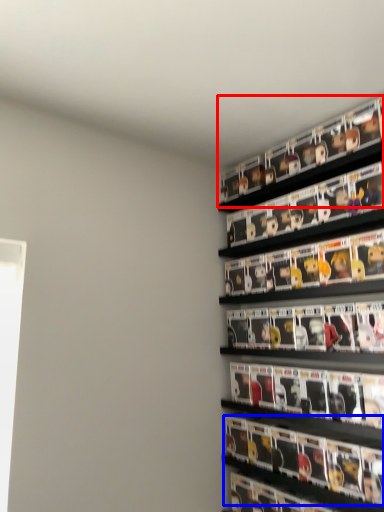
Question: Which of the following is the closest to the observer, shelf (highlighted by a red box) or magazine (highlighted by a blue box)?

Choices:
 (A) shelf
 (B) magazine

Answer: (B)